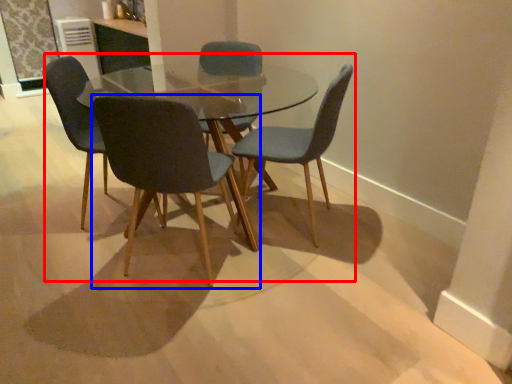
Question: Which object is closer to the camera taking this photo, kitchen & dining room table (highlighted by a red box) or chair (highlighted by a blue box)?

Choices:
 (A) kitchen & dining room table
 (B) chair

Answer: (B)